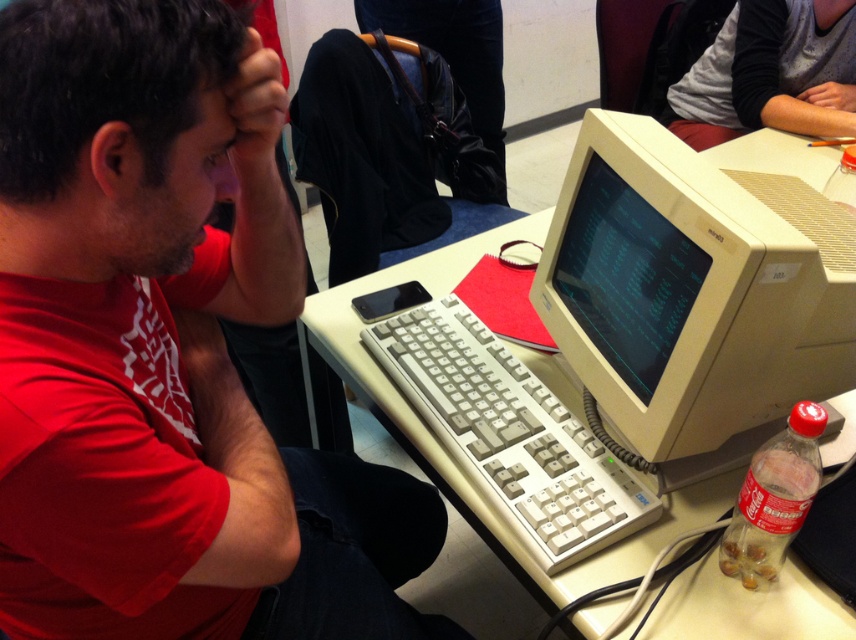
Consider the image. You are a photographer standing 24 inches away from the camera. You want to take a photo of the matte red shirt at left without moving the shirt. Can you adjust your position to ensure the shirt is in focus?

The matte red shirt at left is currently 20.64 inches from the camera. Since you are standing 24 inches away, you need to move closer by 3.36 inches to match the shirt distance for focus alignment.

You are standing in the room and want to place a large object on the white plastic table at center. However, there is a gray fabric shirt at upper right in the background. Can you place the object on the table without it blocking the view of the shirt?

The white plastic table at center is in front of the gray fabric shirt at upper right, so placing a large object on the table may block the view of the shirt since the table is closer to you than the shirt.

You are a photographer trying to capture a photo of the beige plastic monitor at center and the gray fabric shirt at upper right. Since you want both objects to be clearly visible in the frame, which object should you focus on first to ensure proper focus, considering their sizes?

The beige plastic monitor at center is taller than the gray fabric shirt at upper right, so you should focus on the beige plastic monitor at center first to ensure proper focus, as larger objects require more precise focusing to capture all details clearly.